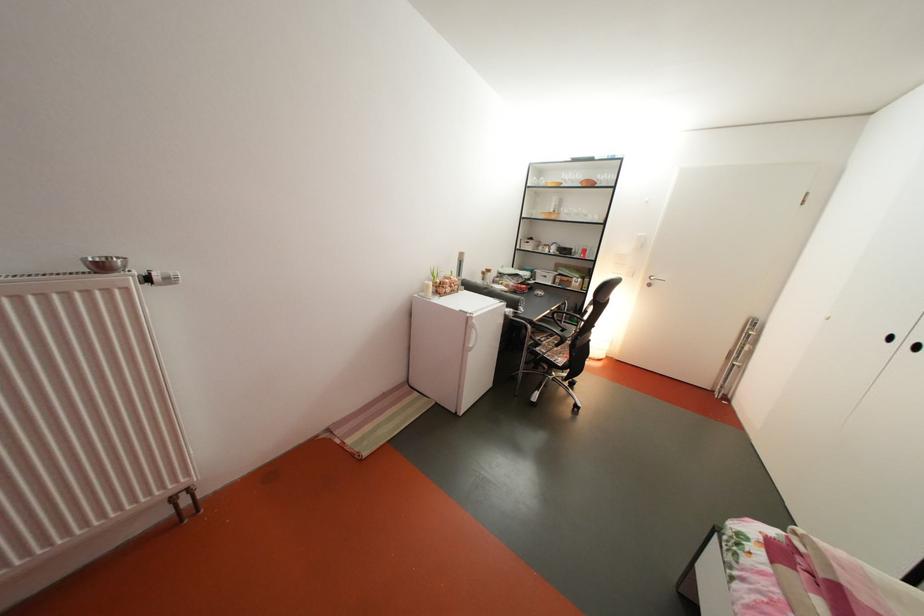
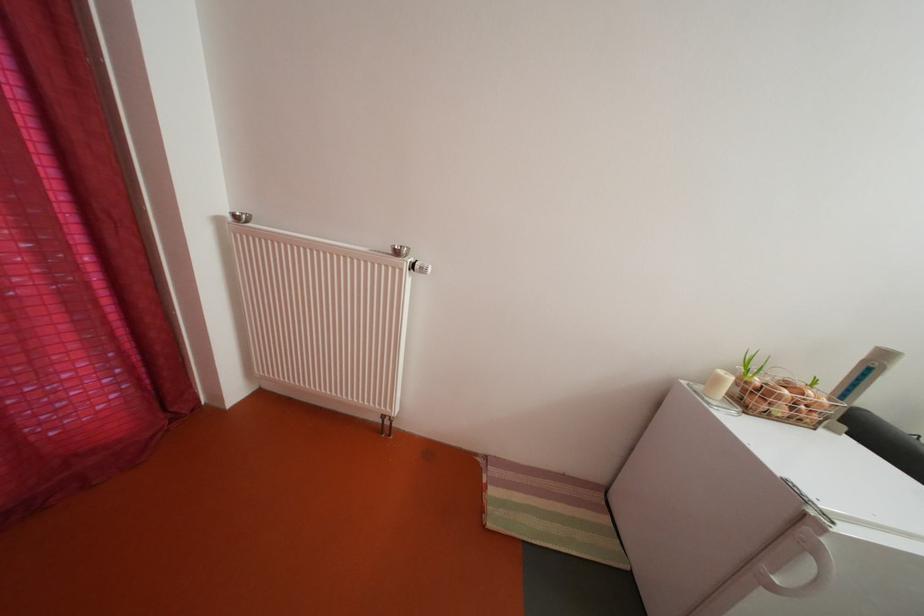
Where in the second image is the point corresponding to pixel 168 285 from the first image?

(429, 273)